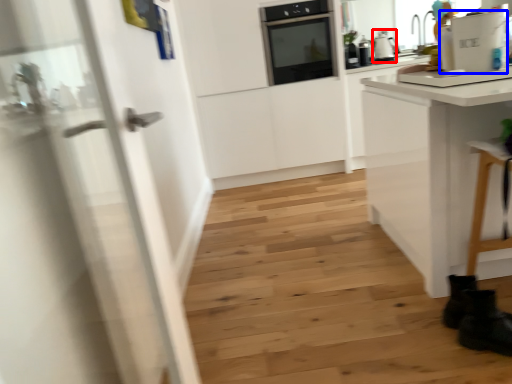
Question: Which point is further to the camera, kitchen appliance (highlighted by a red box) or appliance (highlighted by a blue box)?

Choices:
 (A) kitchen appliance
 (B) appliance

Answer: (A)